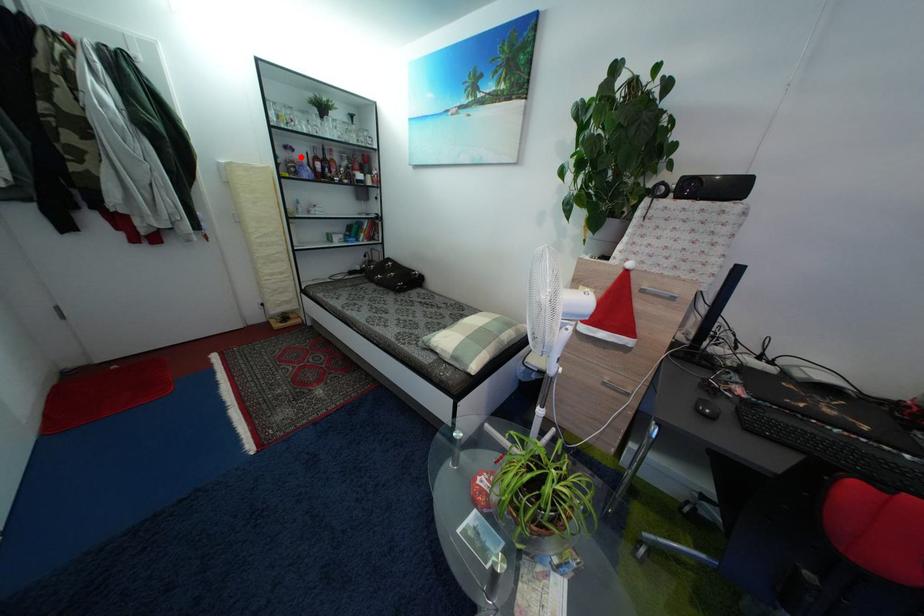
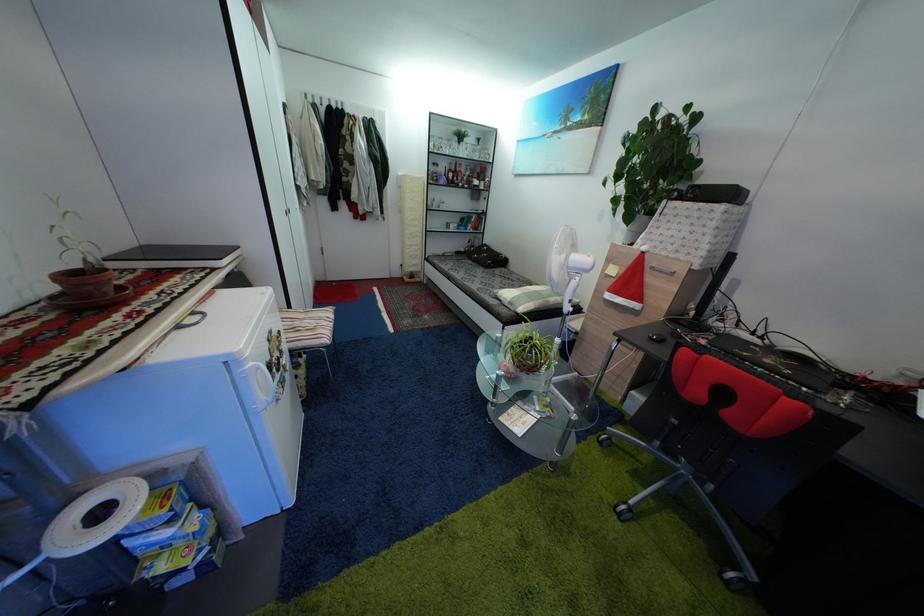
Locate, in the second image, the point that corresponds to the highlighted location in the first image.

(445, 172)